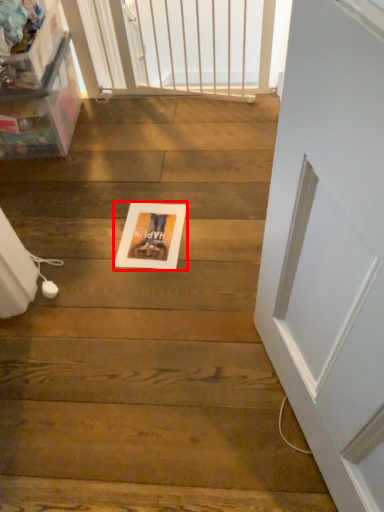
Question: Where is postcard (annotated by the red box) located in relation to screen door in the image?

Choices:
 (A) right
 (B) left

Answer: (B)